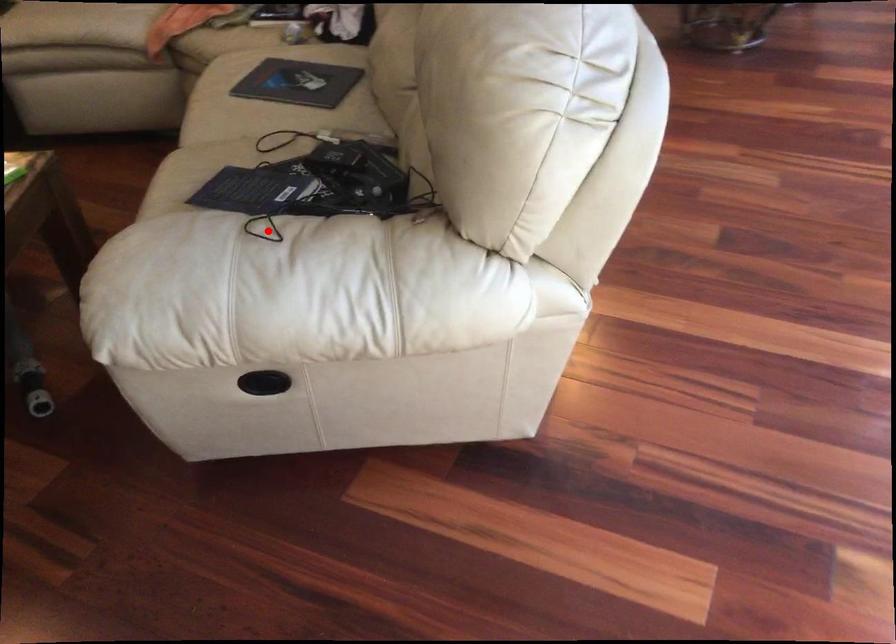
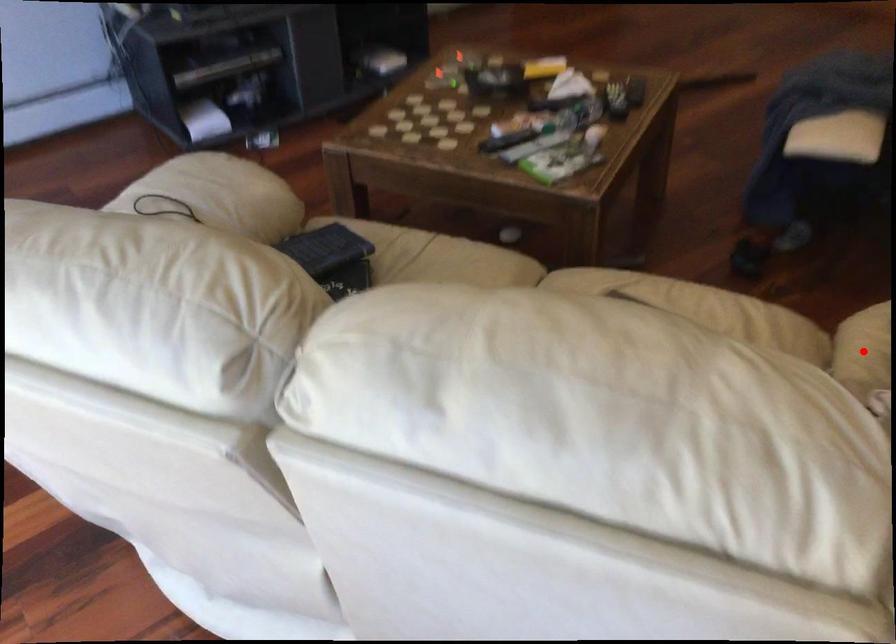
I am providing you with two images of the same scene from different viewpoints. A red point is marked on the first image and another point is marked on the second image. Is the marked point in image1 the same physical position as the marked point in image2?

No